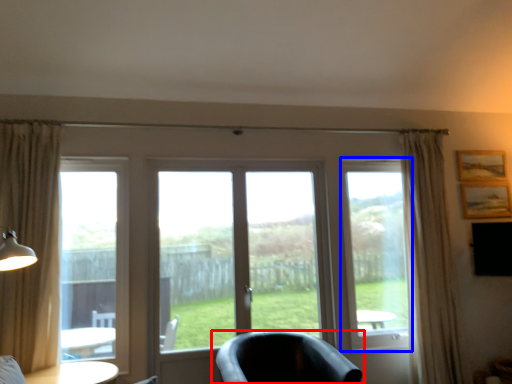
Question: Among these objects, which one is nearest to the camera, chair (highlighted by a red box) or window screen (highlighted by a blue box)?

Choices:
 (A) chair
 (B) window screen

Answer: (A)